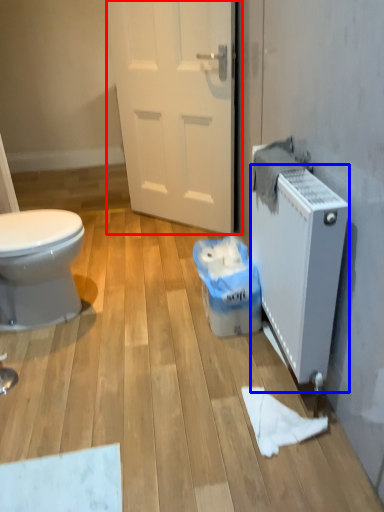
Question: Which of the following is the farthest to the observer, door (highlighted by a red box) or radiator (highlighted by a blue box)?

Choices:
 (A) door
 (B) radiator

Answer: (A)